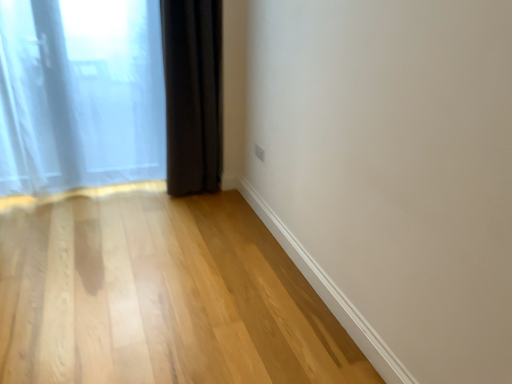
Question: Is translucent fabric curtain at left, marked as the 1th curtain in a left-to-right arrangement, in contact with light wood floor at lower left?

Choices:
 (A) no
 (B) yes

Answer: (A)

Question: Considering the relative sizes of translucent fabric curtain at left, marked as the 1th curtain in a left-to-right arrangement, and light wood floor at lower left in the image provided, is translucent fabric curtain at left, marked as the 1th curtain in a left-to-right arrangement, taller than light wood floor at lower left?

Choices:
 (A) no
 (B) yes

Answer: (B)

Question: Can you confirm if translucent fabric curtain at left, placed as the second curtain when sorted from right to left, is positioned to the right of light wood floor at lower left?

Choices:
 (A) yes
 (B) no

Answer: (B)

Question: From a real-world perspective, does translucent fabric curtain at left, marked as the 1th curtain in a left-to-right arrangement, sit lower than light wood floor at lower left?

Choices:
 (A) no
 (B) yes

Answer: (A)

Question: Can you confirm if translucent fabric curtain at left, marked as the 1th curtain in a left-to-right arrangement, is bigger than light wood floor at lower left?

Choices:
 (A) no
 (B) yes

Answer: (B)

Question: Is translucent fabric curtain at left, marked as the 1th curtain in a left-to-right arrangement, positioned behind light wood floor at lower left?

Choices:
 (A) no
 (B) yes

Answer: (B)

Question: Considering the relative sizes of translucent fabric curtain at left, marked as the 1th curtain in a left-to-right arrangement, and dark matte curtain at lower left, which ranks as the first curtain in right-to-left order, in the image provided, is translucent fabric curtain at left, marked as the 1th curtain in a left-to-right arrangement, smaller than dark matte curtain at lower left, which ranks as the first curtain in right-to-left order,?

Choices:
 (A) no
 (B) yes

Answer: (A)

Question: From a real-world perspective, is translucent fabric curtain at left, placed as the second curtain when sorted from right to left, physically below dark matte curtain at lower left, acting as the 2th curtain starting from the left?

Choices:
 (A) no
 (B) yes

Answer: (B)

Question: Can you confirm if translucent fabric curtain at left, marked as the 1th curtain in a left-to-right arrangement, is thinner than dark matte curtain at lower left, acting as the 2th curtain starting from the left?

Choices:
 (A) yes
 (B) no

Answer: (A)

Question: From a real-world perspective, is translucent fabric curtain at left, marked as the 1th curtain in a left-to-right arrangement, on dark matte curtain at lower left, which ranks as the first curtain in right-to-left order?

Choices:
 (A) no
 (B) yes

Answer: (A)

Question: Is translucent fabric curtain at left, marked as the 1th curtain in a left-to-right arrangement, looking in the opposite direction of dark matte curtain at lower left, which ranks as the first curtain in right-to-left order?

Choices:
 (A) yes
 (B) no

Answer: (B)

Question: Is translucent fabric curtain at left, placed as the second curtain when sorted from right to left, directly adjacent to dark matte curtain at lower left, which ranks as the first curtain in right-to-left order?

Choices:
 (A) yes
 (B) no

Answer: (B)

Question: Does dark matte curtain at lower left, which ranks as the first curtain in right-to-left order, have a smaller size compared to translucent fabric curtain at left, placed as the second curtain when sorted from right to left?

Choices:
 (A) no
 (B) yes

Answer: (B)